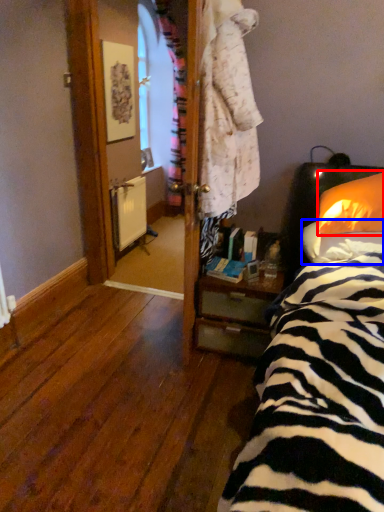
Question: Among these objects, which one is farthest to the camera, pillow (highlighted by a red box) or pillow (highlighted by a blue box)?

Choices:
 (A) pillow
 (B) pillow

Answer: (A)